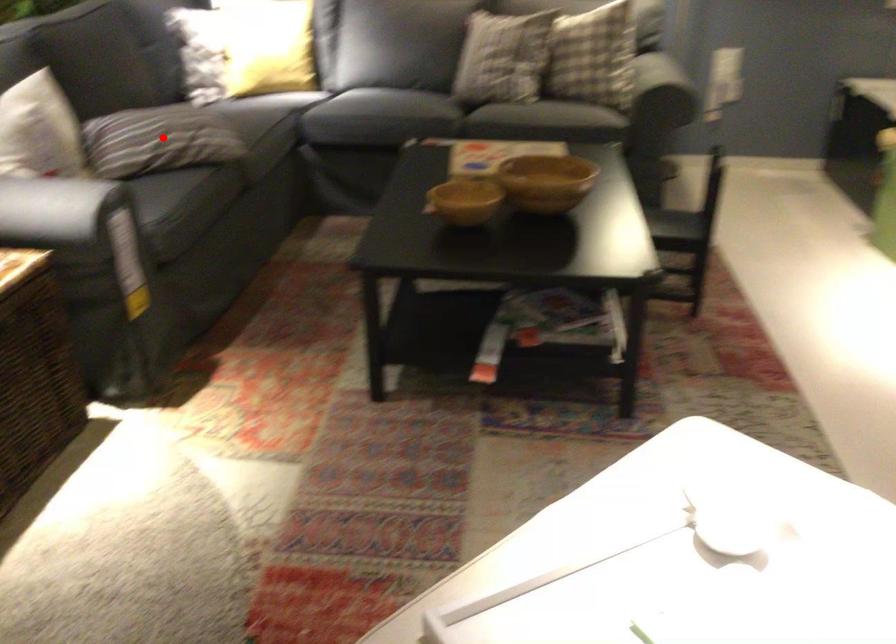
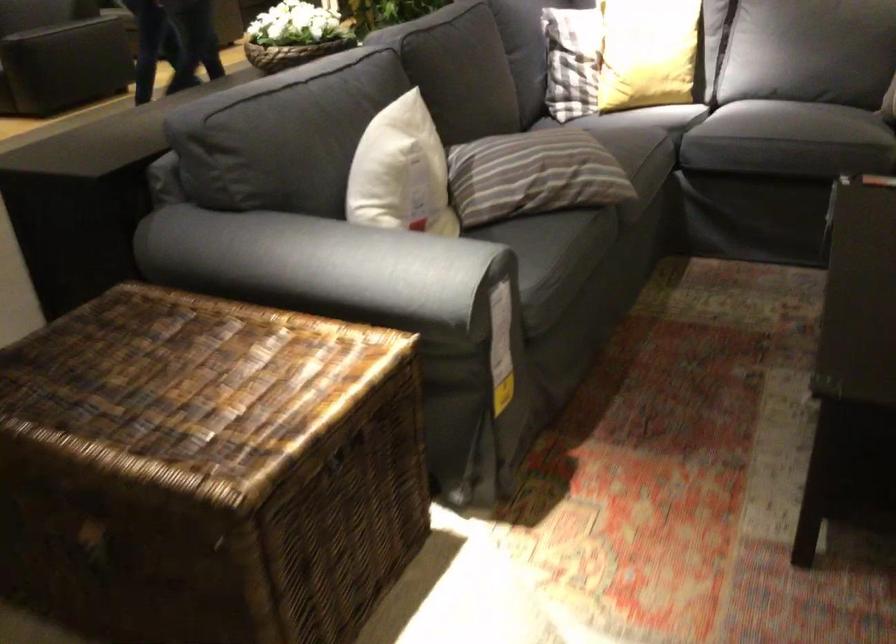
In the second image, find the point that corresponds to the highlighted location in the first image.

(533, 174)